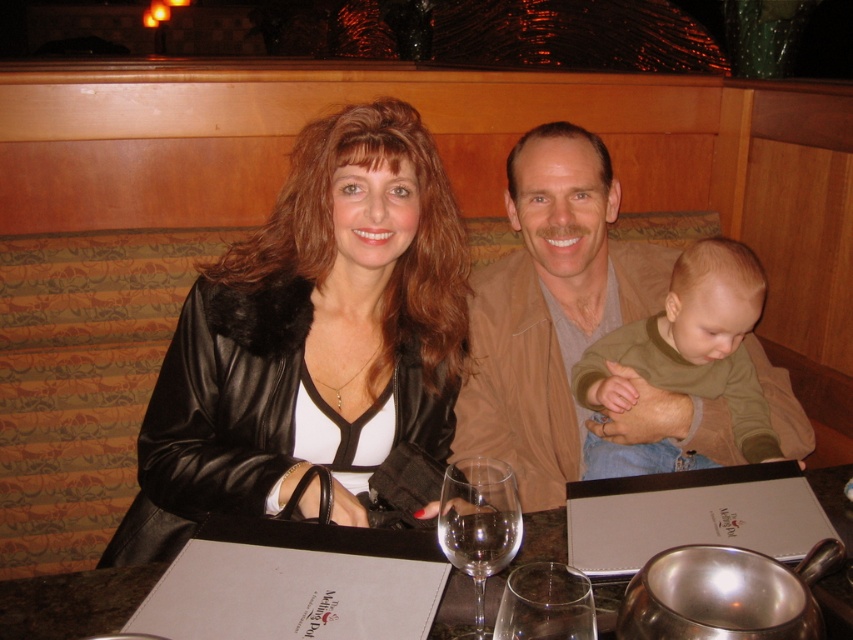
Does point (456, 580) come farther from viewer compared to point (456, 474)?

Yes, it is.

Is matte white menu at center above transparent glass at table center?

Actually, matte white menu at center is below transparent glass at table center.

Locate an element on the screen. matte white menu at center is located at coordinates (73, 602).

Is tan leather jacket at center smaller than transparent glass at table center?

Incorrect, tan leather jacket at center is not smaller in size than transparent glass at table center.

Describe the element at coordinates (566, 324) in the screenshot. I see `tan leather jacket at center` at that location.

Locate an element on the screen. The width and height of the screenshot is (853, 640). tan leather jacket at center is located at coordinates (566, 324).

Identify the location of tan leather jacket at center. The image size is (853, 640). (566, 324).

Locate an element on the screen. Image resolution: width=853 pixels, height=640 pixels. green cotton shirt at center is located at coordinates (692, 344).

Measure the distance from green cotton shirt at center to matte white menu at center.

The distance of green cotton shirt at center from matte white menu at center is 11.35 inches.

Is point (730, 273) farther from viewer compared to point (56, 604)?

Yes, point (730, 273) is farther from viewer.

Find the location of a particular element. green cotton shirt at center is located at coordinates (692, 344).